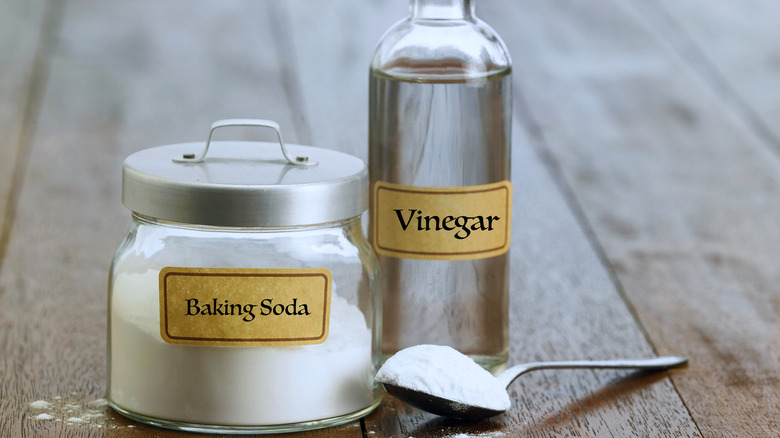
I want to click on spoon, so click(x=438, y=406).